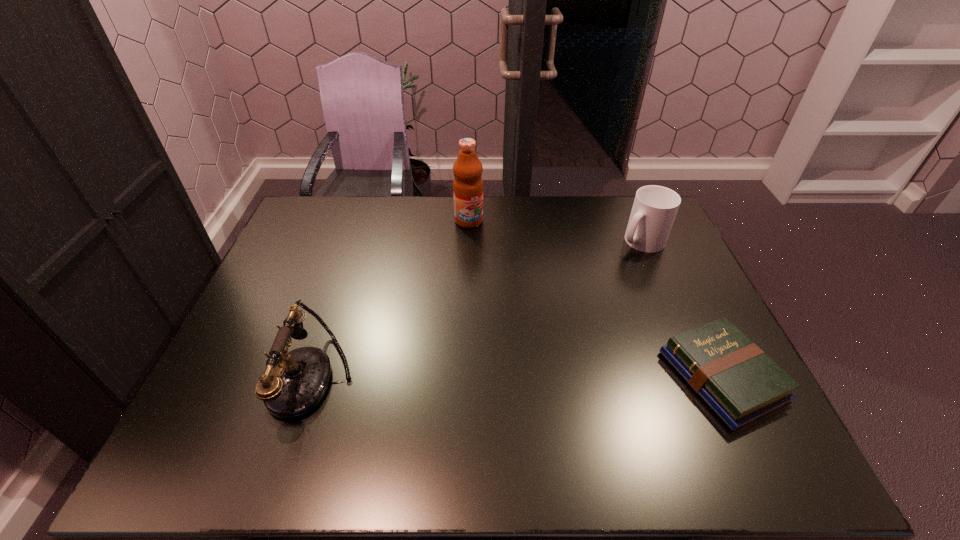
What are the coordinates of `vacant area between the shortest object and the tallest object` in the screenshot? It's located at (595, 299).

Where is `vacant point located between the telephone and the second object from left to right`? Image resolution: width=960 pixels, height=540 pixels. vacant point located between the telephone and the second object from left to right is located at coordinates (391, 299).

The height and width of the screenshot is (540, 960). In order to click on vacant area between the book and the fruit juice in this screenshot , I will do `click(595, 299)`.

Identify the location of free spot between the book and the mug. (682, 309).

Locate an element on the screen. This screenshot has width=960, height=540. empty location between the shortest object and the mug is located at coordinates (682, 309).

Where is `empty location between the fruit juice and the leftmost object`? empty location between the fruit juice and the leftmost object is located at coordinates coord(391,299).

Identify the location of free spot between the mug and the telephone. (477, 309).

This screenshot has height=540, width=960. What are the coordinates of `vacant space that is in between the mug and the leftmost object` in the screenshot? It's located at (477, 309).

Choose which object is the second nearest neighbor to the mug. Please provide its 2D coordinates. Your answer should be formatted as a tuple, i.e. [(x, y)], where the tuple contains the x and y coordinates of a point satisfying the conditions above.

[(468, 185)]

Locate an element on the screen. This screenshot has width=960, height=540. the third closest object relative to the telephone is located at coordinates (654, 209).